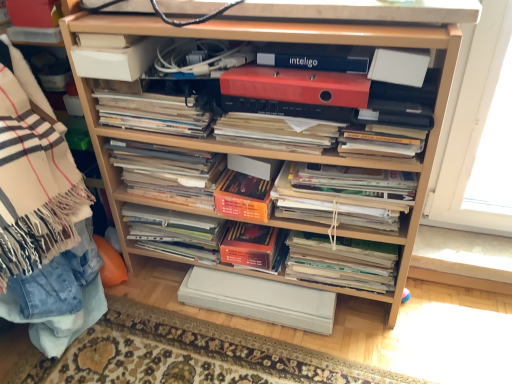
You are a GUI agent. You are given a task and a screenshot of the screen. Output one action in this format:
    pyautogui.click(x=<x>, y=<y>)
    Task: Click on the free space above matte cardboard magazine at center, which appears as the second magazine when ordered from the bottom (from a real-world perspective)
    The height and width of the screenshot is (384, 512).
    Given the screenshot: What is the action you would take?
    pyautogui.click(x=169, y=213)